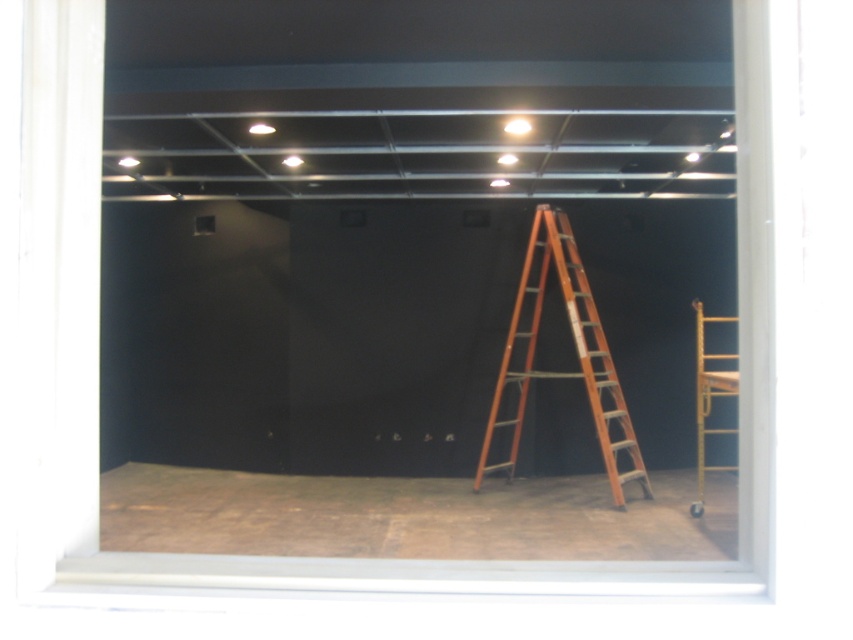
Where is `brown wood floor at lower center`? This screenshot has height=640, width=853. brown wood floor at lower center is located at coordinates (412, 515).

Is point (170, 467) positioned in front of point (619, 499)?

No.

Locate an element on the screen. This screenshot has height=640, width=853. brown wood floor at lower center is located at coordinates (412, 515).